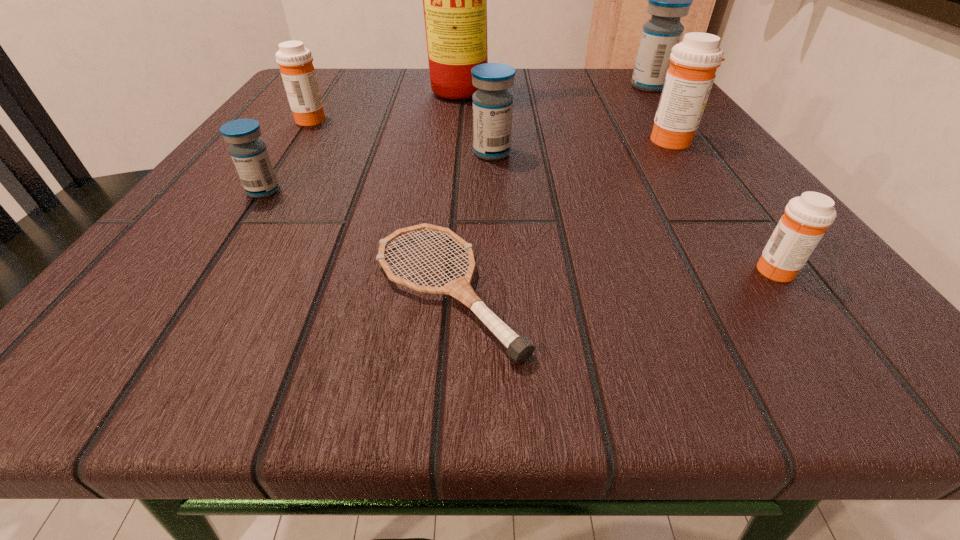
Where is `the third nearest object`? This screenshot has height=540, width=960. the third nearest object is located at coordinates (250, 156).

Where is `the nearest medicine`? The height and width of the screenshot is (540, 960). the nearest medicine is located at coordinates (806, 218).

Where is `the smallest orange medicine`? This screenshot has width=960, height=540. the smallest orange medicine is located at coordinates (806, 218).

Identify the location of tennis racket. This screenshot has width=960, height=540. (519, 348).

Where is `the shortest object`? the shortest object is located at coordinates (519, 348).

Where is `blank space located on the front-facing side of the fire extinguisher`? The image size is (960, 540). blank space located on the front-facing side of the fire extinguisher is located at coordinates (467, 136).

Locate an element on the screen. This screenshot has height=540, width=960. vacant area located on the left of the biggest blue medicine is located at coordinates (554, 86).

Locate an element on the screen. The image size is (960, 540). free space located 0.210m on the back of the second nearest orange medicine is located at coordinates (635, 84).

Where is `free space located on the left of the second blue medicine from right to left`? free space located on the left of the second blue medicine from right to left is located at coordinates (359, 153).

Locate an element on the screen. free space located on the front of the leftmost orange medicine is located at coordinates (280, 162).